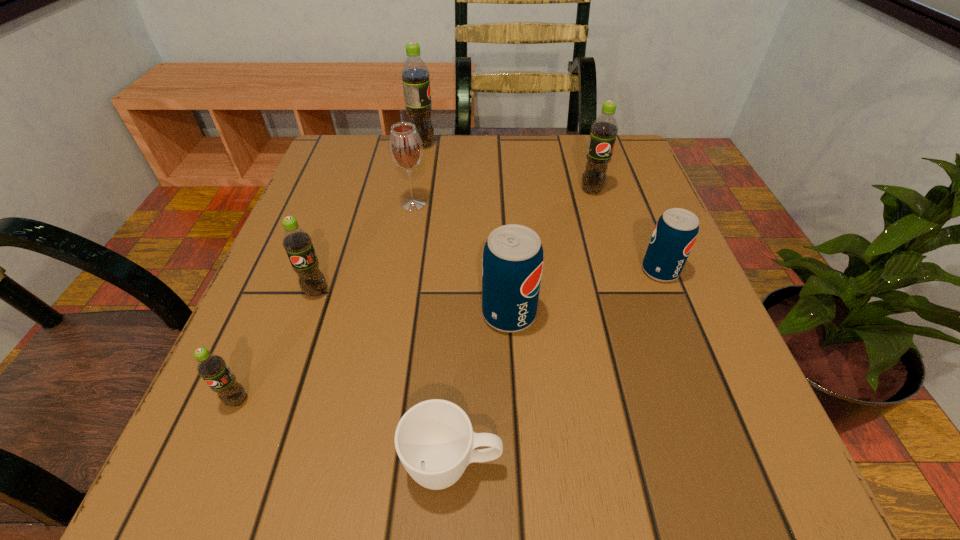
Where is `the biggest green soda`? the biggest green soda is located at coordinates (415, 75).

Locate an element on the screen. This screenshot has width=960, height=540. the farthest object is located at coordinates (415, 75).

This screenshot has height=540, width=960. I want to click on the second tallest soda, so click(604, 129).

The image size is (960, 540). In order to click on the rightmost green soda in this screenshot , I will do `click(604, 129)`.

The height and width of the screenshot is (540, 960). I want to click on wineglass, so click(x=405, y=146).

Find the location of `the bigger blue pop`. the bigger blue pop is located at coordinates (512, 263).

This screenshot has width=960, height=540. I want to click on the nearer blue pop, so click(512, 263).

You are a GUI agent. You are given a task and a screenshot of the screen. Output one action in this format:
    pyautogui.click(x=<x>, y=<y>)
    Task: Click on the second smallest green soda
    The image size is (960, 540).
    Given the screenshot: What is the action you would take?
    pyautogui.click(x=297, y=242)

At what (x,y) coordinates should I click in order to perform the action: click on the second object from left to right. Please return your answer as a coordinate pair (x, y). Looking at the image, I should click on (297, 242).

The height and width of the screenshot is (540, 960). I want to click on the farther blue pop, so click(675, 233).